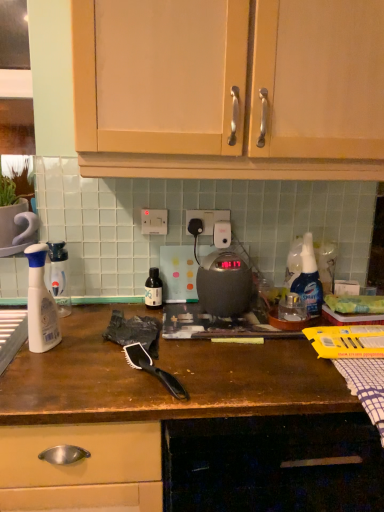
Locate an element on the screen. The image size is (384, 512). free spot to the left of matte black bottle at center, which is counted as the 2th bottle, starting from the left is located at coordinates (102, 313).